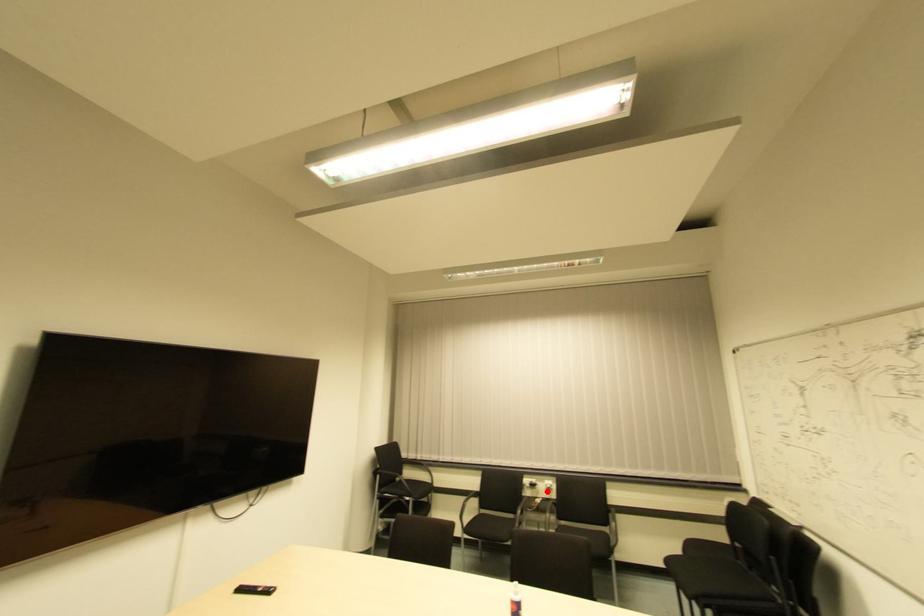
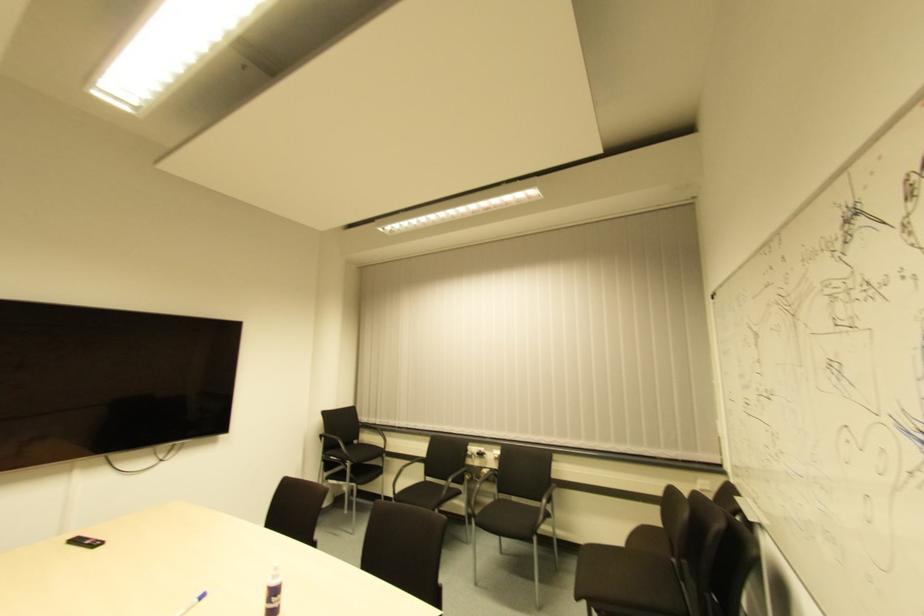
In the second image, find the point that corresponds to the highlighted location in the first image.

(494, 462)